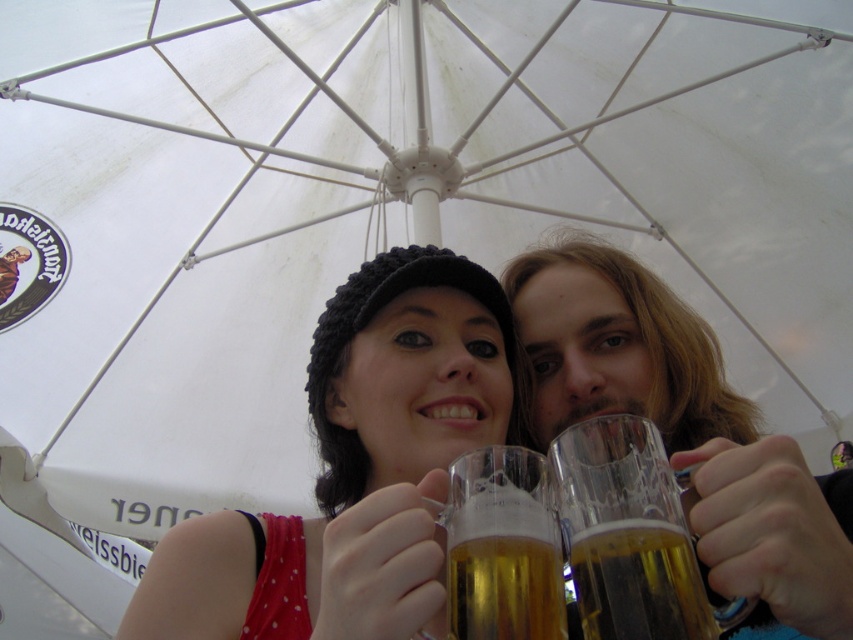
You are a photographer standing at the origin point of the image coordinate system. You need to place a spotlight at the exact location of the matte black beanie at center. What are the coordinates where you should position the spotlight?

The coordinates for the matte black beanie at center are at point (352, 467), so you should position the spotlight at those coordinates.

You are standing in front of the canopy at the event. You see the translucent glass mug at upper right. Can you reach it without moving your position?

The translucent glass mug at upper right is 4.98 meters from viewer, so you cannot reach it without moving your position because it is too far away.

You are at a festival and see two mugs under the canopy. The translucent glass mug at center and the golden glass mug at center. Which mug can hold more liquid?

The translucent glass mug at center is larger in size than the golden glass mug at center, so it can hold more liquid.